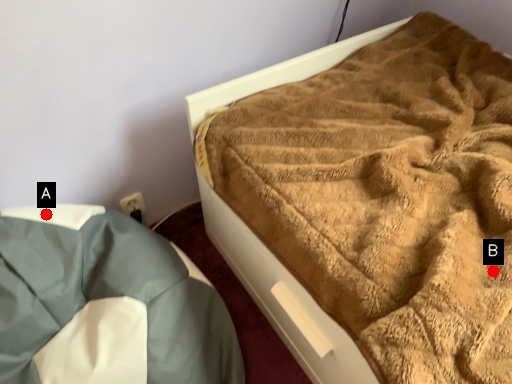
Question: Two points are circled on the image, labeled by A and B beside each circle. Which point is farther from the camera taking this photo?

Choices:
 (A) A is further
 (B) B is further

Answer: (A)